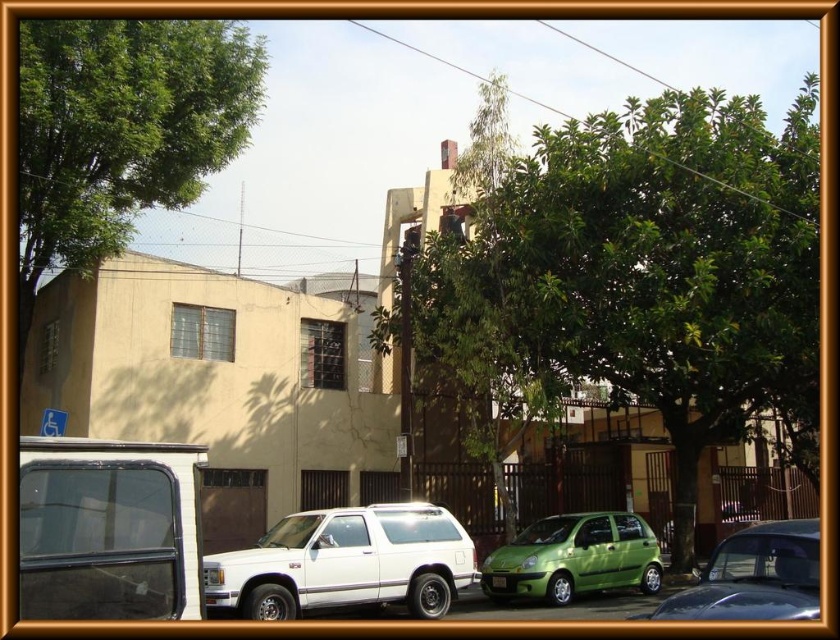
You are a delivery driver who needs to park your vehicle between the white matte suv at center and the green matte hatchback at lower right. Given that your vehicle is 1.8 meters tall, will there be enough vertical clearance to park there?

The white matte suv at center is taller than the green matte hatchback at lower right. Since the suv is taller, the vertical clearance between them may be sufficient for your 1.8 meter tall vehicle, but it depends on the exact height difference. However, without specific measurements, we can only confirm that the suv is taller, so there might be enough space if the hatchback is lower.

You are a delivery driver who needs to park your truck between the white matte suv at center and the green matte hatchback at lower right. Based on the scene, can you fit your truck there?

The white matte suv at center is to the left of the green matte hatchback at lower right, so there is space between them. However, the scene doesn not provide information about the exact distance between the two vehicles or the width of the parking area. Without knowing the truck size or available space, it is impossible to determine if it will fit.

You are a delivery driver who needs to park your vehicle between the green leafy tree at center and the white matte suv at center. Is there enough space for your car, which is 4.5 meters long?

A: The white matte suv at center is behind the green leafy tree at center, so there is space between them. However, without knowing the exact distance between the tree and the SUV, it is impossible to determine if the 4.5 meter car can fit.